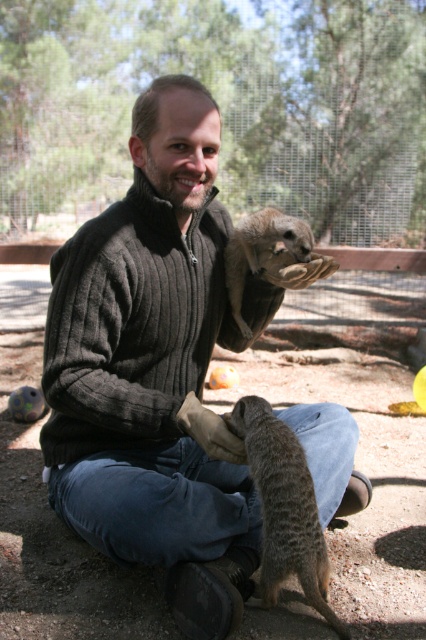
Between dark gray sweater at center and grayish-brown fur meerkat at lower center, which one is positioned higher?

dark gray sweater at center

Looking at this image, which is more to the left, dark gray sweater at center or grayish-brown fur meerkat at lower center?

dark gray sweater at center is more to the left.

You are a GUI agent. You are given a task and a screenshot of the screen. Output one action in this format:
    pyautogui.click(x=<x>, y=<y>)
    Task: Click on the dark gray sweater at center
    Image resolution: width=426 pixels, height=640 pixels.
    Given the screenshot: What is the action you would take?
    pyautogui.click(x=158, y=362)

The width and height of the screenshot is (426, 640). In order to click on dark gray sweater at center in this screenshot , I will do `click(158, 362)`.

Which of these two, grayish-brown fur meerkat at lower center or grayish-brown fur meerkat at upper center, stands shorter?

grayish-brown fur meerkat at upper center

This screenshot has width=426, height=640. What do you see at coordinates (284, 506) in the screenshot?
I see `grayish-brown fur meerkat at lower center` at bounding box center [284, 506].

Image resolution: width=426 pixels, height=640 pixels. Identify the location of grayish-brown fur meerkat at lower center. (284, 506).

Is dark gray sweater at center to the left of grayish-brown fur meerkat at upper center from the viewer's perspective?

Correct, you'll find dark gray sweater at center to the left of grayish-brown fur meerkat at upper center.

Does dark gray sweater at center appear under grayish-brown fur meerkat at upper center?

Yes, dark gray sweater at center is below grayish-brown fur meerkat at upper center.

Is point (279, 284) positioned before point (291, 232)?

No, (279, 284) is behind (291, 232).

Locate an element on the screen. The height and width of the screenshot is (640, 426). dark gray sweater at center is located at coordinates (158, 362).